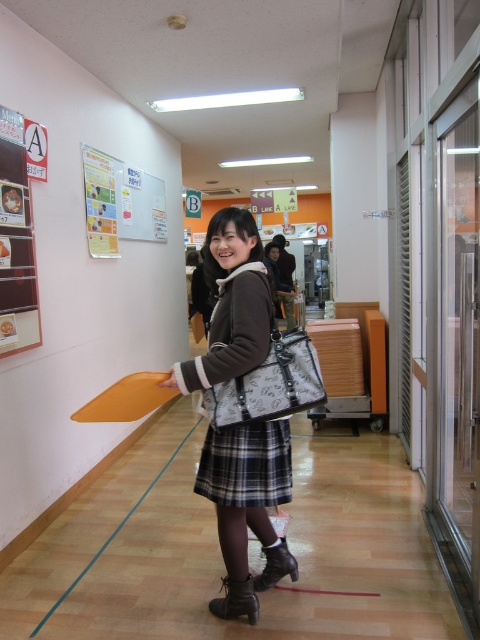
Question: Is plaid skirt at center behind matte white paper at upper left?

Choices:
 (A) yes
 (B) no

Answer: (B)

Question: Which of the following is the closest to the observer?

Choices:
 (A) (205, 490)
 (B) (252, 352)
 (C) (243, 460)
 (D) (294, 570)

Answer: (B)

Question: Can you confirm if plaid fabric dress at center is positioned above black leather boot at lower center?

Choices:
 (A) yes
 (B) no

Answer: (A)

Question: Can you confirm if plaid skirt at center is positioned below matte white paper at upper left?

Choices:
 (A) yes
 (B) no

Answer: (A)

Question: Which point is farther to the camera?

Choices:
 (A) plaid skirt at center
 (B) plaid fabric skirt at center

Answer: (B)

Question: Which point is closer to the camera?

Choices:
 (A) black leather boot at lower center
 (B) plaid fabric dress at center
 (C) plaid fabric skirt at center

Answer: (B)